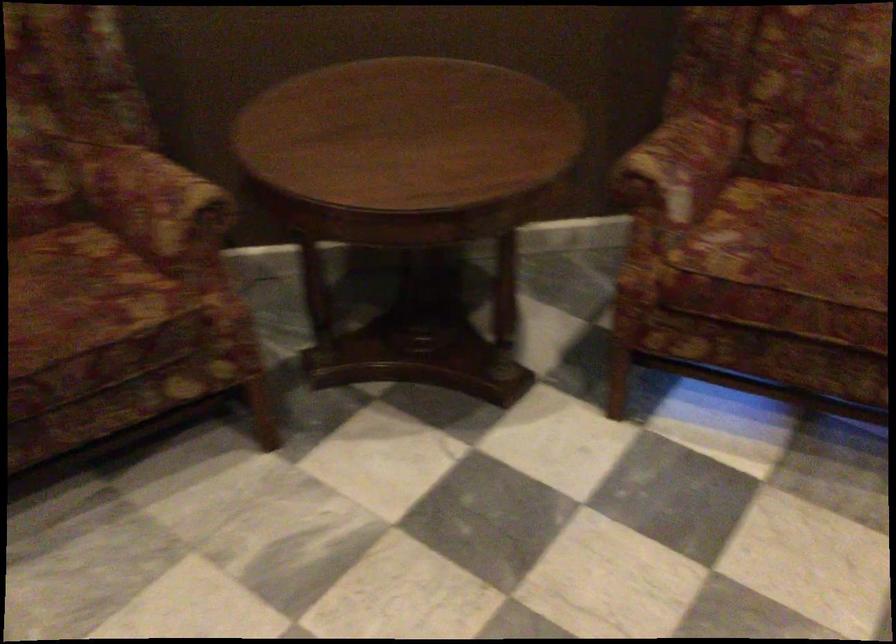
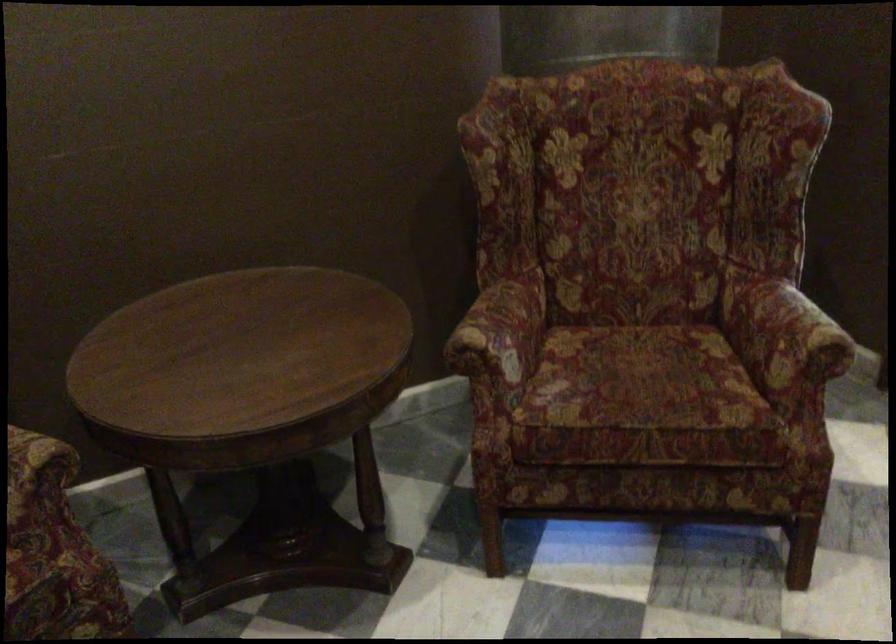
Locate, in the second image, the point that corresponds to point (673, 165) in the first image.

(501, 330)